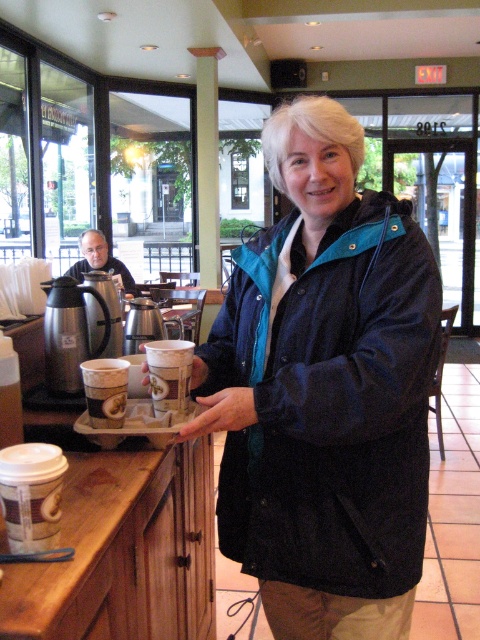
Does dark blue corduroy jacket at center have a greater width compared to matte plastic cup at center?

Yes, dark blue corduroy jacket at center is wider than matte plastic cup at center.

Between dark blue corduroy jacket at center and matte plastic cup at center, which one is positioned lower?

matte plastic cup at center is below.

This screenshot has width=480, height=640. What do you see at coordinates (331, 403) in the screenshot?
I see `dark blue corduroy jacket at center` at bounding box center [331, 403].

Find the location of a particular element. The width and height of the screenshot is (480, 640). dark blue corduroy jacket at center is located at coordinates (331, 403).

Is the position of white paper cup at center more distant than that of matte plastic cup at center?

No.

Does white paper cup at center have a smaller size compared to matte plastic cup at center?

No, white paper cup at center is not smaller than matte plastic cup at center.

Which is behind, point (154, 410) or point (86, 372)?

The point (154, 410) is more distant.

Find the location of `white paper cup at center`. white paper cup at center is located at coordinates (168, 372).

Locate an element on the screen. dark blue corduroy jacket at center is located at coordinates (331, 403).

Who is shorter, dark blue corduroy jacket at center or smooth skin hand at center?

With less height is smooth skin hand at center.

Does point (340, 396) lie behind point (201, 420)?

That is False.

The image size is (480, 640). What are the coordinates of `dark blue corduroy jacket at center` in the screenshot? It's located at (331, 403).